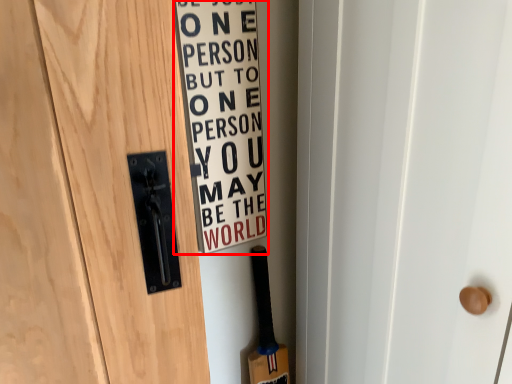
Question: From the image's perspective, what is the correct spatial relationship of warning sign (annotated by the red box) in relation to baseball bat?

Choices:
 (A) below
 (B) above

Answer: (B)